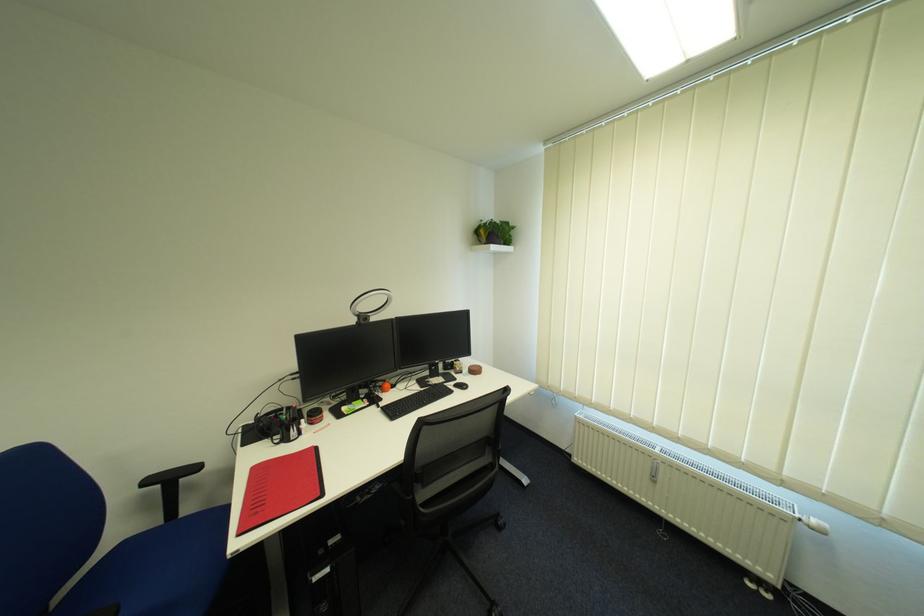
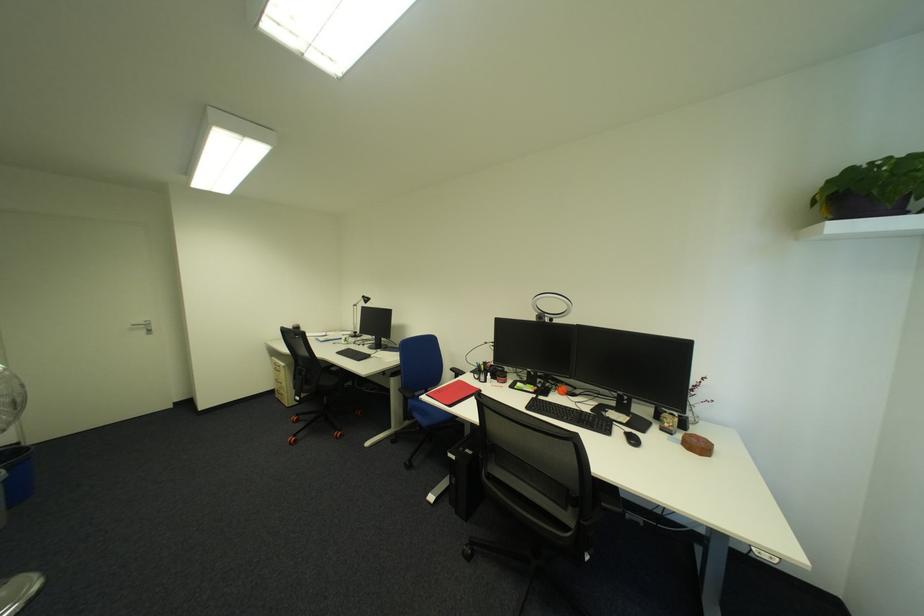
Find the pixel in the second image that matches (x=468, y=368) in the first image.

(677, 424)